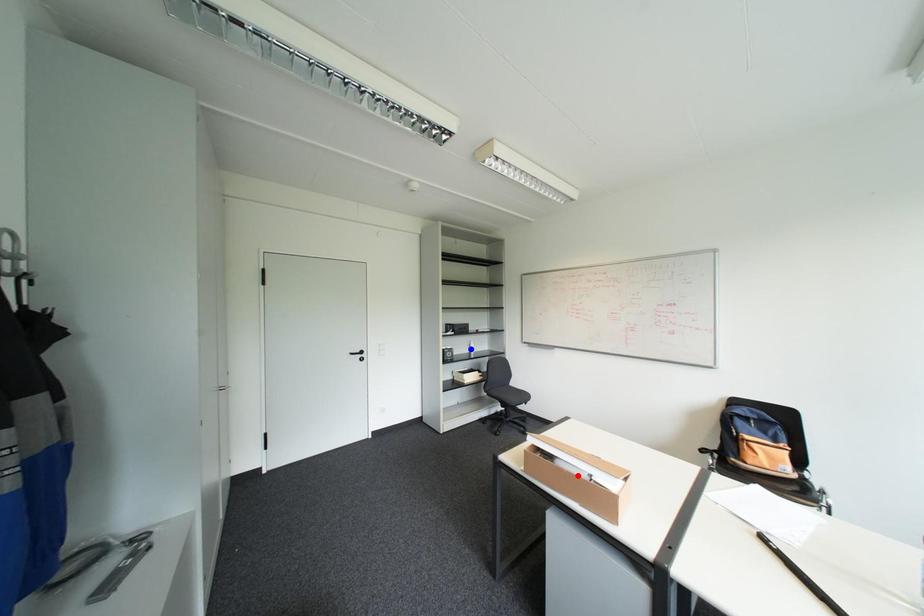
Question: Which of the two points in the image is closer to the camera?

Choices:
 (A) Blue point is closer.
 (B) Red point is closer.

Answer: (B)